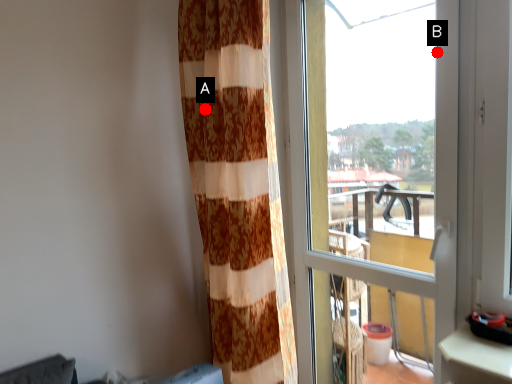
Question: Two points are circled on the image, labeled by A and B beside each circle. Which point is further to the camera?

Choices:
 (A) A is further
 (B) B is further

Answer: (A)